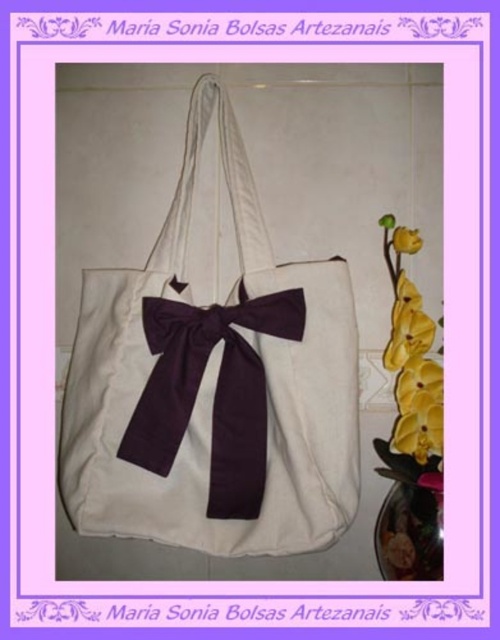
You are trying to place the yellow fabric flower at right on top of the white canvas tote at center. Based on their widths, will the flower fit entirely on the tote?

The white canvas tote at center might be wider than yellow fabric flower at right, so there is a possibility that the flower will fit, but it is uncertain without exact measurements.

You are arranging decorations on a tote bag. You have a purple satin bow at center and a yellow matte flower at upper right. According to the image, which decoration is positioned more to the left?

The purple satin bow at center is positioned more to the left than the yellow matte flower at upper right.

You are organizing a small art exhibition and need to place the white canvas tote at center and the yellow fabric flower at right on a shelf. Which object should you place first to ensure proper spacing?

The white canvas tote at center has a greater height compared to the yellow fabric flower at right, so you should place the white canvas tote at center first to ensure it doesn not block the view of the smaller yellow fabric flower at right.